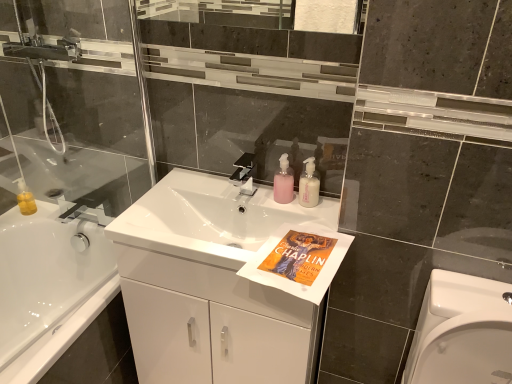
What is the approximate width of pink translucent pump bottle at center, the 2th toiletry in the right-to-left sequence?

pink translucent pump bottle at center, the 2th toiletry in the right-to-left sequence, is 3.13 inches in width.

You are a GUI agent. You are given a task and a screenshot of the screen. Output one action in this format:
    pyautogui.click(x=<x>, y=<y>)
    Task: Click on the pink translucent pump bottle at center, which is counted as the first toiletry, starting from the left
    The width and height of the screenshot is (512, 384).
    Given the screenshot: What is the action you would take?
    pyautogui.click(x=283, y=182)

The width and height of the screenshot is (512, 384). I want to click on transparent glass shower door at left, so click(x=75, y=102).

Where is `pink matte soap dispenser at center, which ranks as the first toiletry in right-to-left order`? pink matte soap dispenser at center, which ranks as the first toiletry in right-to-left order is located at coordinates (309, 185).

Identify the location of pink translucent pump bottle at center, the 2th toiletry in the right-to-left sequence. (283, 182).

Considering the sizes of objects pink matte soap dispenser at center, which ranks as the first toiletry in right-to-left order, and satin nickel faucet at center in the image provided, who is bigger, pink matte soap dispenser at center, which ranks as the first toiletry in right-to-left order, or satin nickel faucet at center?

satin nickel faucet at center is bigger.

Which point is more forward, (304,179) or (251,166)?

Positioned in front is point (304,179).

Which object is thinner, pink matte soap dispenser at center, which ranks as the first toiletry in right-to-left order, or satin nickel faucet at center?

pink matte soap dispenser at center, which ranks as the first toiletry in right-to-left order, is thinner.

From the image's perspective, is pink matte soap dispenser at center, which ranks as the first toiletry in right-to-left order, under satin nickel faucet at center?

Indeed, from the image's perspective, pink matte soap dispenser at center, which ranks as the first toiletry in right-to-left order, is shown beneath satin nickel faucet at center.

Which is closer, (287, 159) or (307, 172)?

Point (287, 159).

From the image's perspective, which one is positioned lower, pink translucent pump bottle at center, the 2th toiletry in the right-to-left sequence, or pink matte soap dispenser at center, marked as the 2th toiletry in a left-to-right arrangement?

pink matte soap dispenser at center, marked as the 2th toiletry in a left-to-right arrangement, appears lower in the image.

Considering the positions of objects pink translucent pump bottle at center, the 2th toiletry in the right-to-left sequence, and pink matte soap dispenser at center, marked as the 2th toiletry in a left-to-right arrangement, in the image provided, who is more to the left, pink translucent pump bottle at center, the 2th toiletry in the right-to-left sequence, or pink matte soap dispenser at center, marked as the 2th toiletry in a left-to-right arrangement,?

pink translucent pump bottle at center, the 2th toiletry in the right-to-left sequence.

Which of these two, pink translucent pump bottle at center, which is counted as the first toiletry, starting from the left, or pink matte soap dispenser at center, marked as the 2th toiletry in a left-to-right arrangement, is bigger?

Bigger between the two is pink translucent pump bottle at center, which is counted as the first toiletry, starting from the left.

Does white glossy cabinet at center have a lesser width compared to pink matte soap dispenser at center, marked as the 2th toiletry in a left-to-right arrangement?

Incorrect, the width of white glossy cabinet at center is not less than that of pink matte soap dispenser at center, marked as the 2th toiletry in a left-to-right arrangement.

Would you say white glossy cabinet at center is a long distance from pink matte soap dispenser at center, which ranks as the first toiletry in right-to-left order?

They are positioned close to each other.

Which of these two, white glossy cabinet at center or pink matte soap dispenser at center, marked as the 2th toiletry in a left-to-right arrangement, stands shorter?

pink matte soap dispenser at center, marked as the 2th toiletry in a left-to-right arrangement.

How far apart are white glossy cabinet at center and pink matte soap dispenser at center, marked as the 2th toiletry in a left-to-right arrangement?

white glossy cabinet at center is 19.75 inches away from pink matte soap dispenser at center, marked as the 2th toiletry in a left-to-right arrangement.

Is white glossy cabinet at center wider than pink translucent pump bottle at center, the 2th toiletry in the right-to-left sequence?

Indeed, white glossy cabinet at center has a greater width compared to pink translucent pump bottle at center, the 2th toiletry in the right-to-left sequence.

Is white glossy cabinet at center outside of pink translucent pump bottle at center, the 2th toiletry in the right-to-left sequence?

Indeed, white glossy cabinet at center is completely outside pink translucent pump bottle at center, the 2th toiletry in the right-to-left sequence.

From the image's perspective, who appears lower, satin nickel faucet at center or pink matte soap dispenser at center, marked as the 2th toiletry in a left-to-right arrangement?

From the image's view, pink matte soap dispenser at center, marked as the 2th toiletry in a left-to-right arrangement, is below.

Could you tell me if satin nickel faucet at center is turned towards pink matte soap dispenser at center, which ranks as the first toiletry in right-to-left order?

No.

How many degrees apart are the facing directions of satin nickel faucet at center and pink matte soap dispenser at center, marked as the 2th toiletry in a left-to-right arrangement?

satin nickel faucet at center and pink matte soap dispenser at center, marked as the 2th toiletry in a left-to-right arrangement, are facing 0.207 degrees away from each other.

Is point (248, 162) closer to viewer compared to point (318, 178)?

No, it is behind (318, 178).

Considering the positions of point (149, 119) and point (283, 171), is point (149, 119) closer or farther from the camera than point (283, 171)?

Point (149, 119) is positioned farther from the camera compared to point (283, 171).

Is transparent glass shower door at left closer to the viewer compared to pink translucent pump bottle at center, which is counted as the first toiletry, starting from the left?

Yes, the depth of transparent glass shower door at left is less than that of pink translucent pump bottle at center, which is counted as the first toiletry, starting from the left.

From a real-world perspective, is transparent glass shower door at left beneath pink translucent pump bottle at center, the 2th toiletry in the right-to-left sequence?

Actually, transparent glass shower door at left is physically above pink translucent pump bottle at center, the 2th toiletry in the right-to-left sequence, in the real world.

Considering the relative positions of white glossy bathtub at left and satin nickel faucet at center in the image provided, is white glossy bathtub at left to the right of satin nickel faucet at center from the viewer's perspective?

In fact, white glossy bathtub at left is to the left of satin nickel faucet at center.

Which of these two, white glossy bathtub at left or satin nickel faucet at center, is bigger?

With larger size is white glossy bathtub at left.

Does white glossy bathtub at left have a greater height compared to satin nickel faucet at center?

Indeed, white glossy bathtub at left has a greater height compared to satin nickel faucet at center.

How many degrees apart are the facing directions of white glossy bathtub at left and satin nickel faucet at center?

The facing directions of white glossy bathtub at left and satin nickel faucet at center are 89.3 degrees apart.

Identify the location of tap that appears above the pink matte soap dispenser at center, marked as the 2th toiletry in a left-to-right arrangement (from the image's perspective). (244, 174).

Find the location of a particular element. This screenshot has width=512, height=384. toiletry lying in front of the pink translucent pump bottle at center, the 2th toiletry in the right-to-left sequence is located at coordinates (309, 185).

Which object lies nearer to the anchor point satin nickel faucet at center, white glossy sink at center or white glossy bathtub at left?

Based on the image, white glossy sink at center appears to be nearer to satin nickel faucet at center.

Considering their positions, is white glossy cabinet at center positioned closer to transparent glass shower door at left than white glossy bathtub at left?

white glossy bathtub at left is positioned closer to the anchor transparent glass shower door at left.

From the image, which object appears to be farther from white glossy sink at center, pink translucent pump bottle at center, which is counted as the first toiletry, starting from the left, or satin nickel faucet at center?

pink translucent pump bottle at center, which is counted as the first toiletry, starting from the left, lies further to white glossy sink at center than the other object.

Which object lies further to the anchor point satin nickel faucet at center, transparent glass shower door at left or pink matte soap dispenser at center, marked as the 2th toiletry in a left-to-right arrangement?

transparent glass shower door at left.

Considering their positions, is satin nickel faucet at center positioned closer to pink translucent pump bottle at center, which is counted as the first toiletry, starting from the left, than white glossy cabinet at center?

The object closer to pink translucent pump bottle at center, which is counted as the first toiletry, starting from the left, is satin nickel faucet at center.

When comparing their distances from transparent glass shower door at left, does satin nickel faucet at center or white glossy sink at center seem closer?

Based on the image, white glossy sink at center appears to be nearer to transparent glass shower door at left.

Based on their spatial positions, is pink matte soap dispenser at center, which ranks as the first toiletry in right-to-left order, or transparent glass shower door at left closer to pink translucent pump bottle at center, the 2th toiletry in the right-to-left sequence?

The object closer to pink translucent pump bottle at center, the 2th toiletry in the right-to-left sequence, is pink matte soap dispenser at center, which ranks as the first toiletry in right-to-left order.

When comparing their distances from white glossy sink at center, does satin nickel faucet at center or transparent glass shower door at left seem further?

transparent glass shower door at left is further to white glossy sink at center.

Find the location of a particular element. The image size is (512, 384). sink that lies between pink translucent pump bottle at center, the 2th toiletry in the right-to-left sequence, and white glossy cabinet at center from top to bottom is located at coordinates (210, 219).

The width and height of the screenshot is (512, 384). Identify the location of tap between transparent glass shower door at left and pink matte soap dispenser at center, which ranks as the first toiletry in right-to-left order. (244, 174).

The height and width of the screenshot is (384, 512). In order to click on shower door located between white glossy bathtub at left and white glossy sink at center in the left-right direction in this screenshot , I will do `click(75, 102)`.

Where is `sink situated between transparent glass shower door at left and pink matte soap dispenser at center, marked as the 2th toiletry in a left-to-right arrangement, from left to right`? Image resolution: width=512 pixels, height=384 pixels. sink situated between transparent glass shower door at left and pink matte soap dispenser at center, marked as the 2th toiletry in a left-to-right arrangement, from left to right is located at coordinates (210, 219).